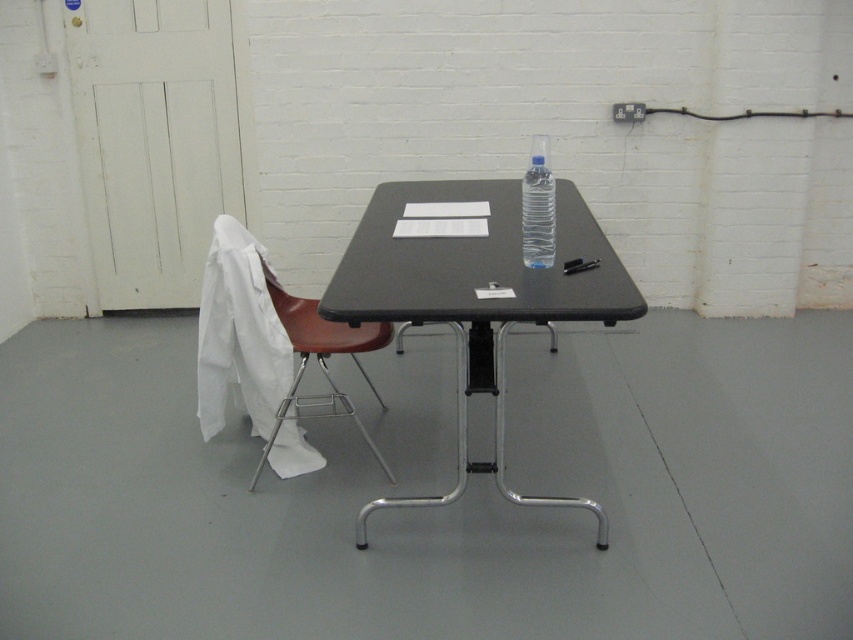
You are standing in the room and want to move from the white door to the black table. Which point, point (312,339) or point (523,232), is closer to your path?

Point (312,339) is further to the viewer than point (523,232), so the closer point to your path would be point (523,232).